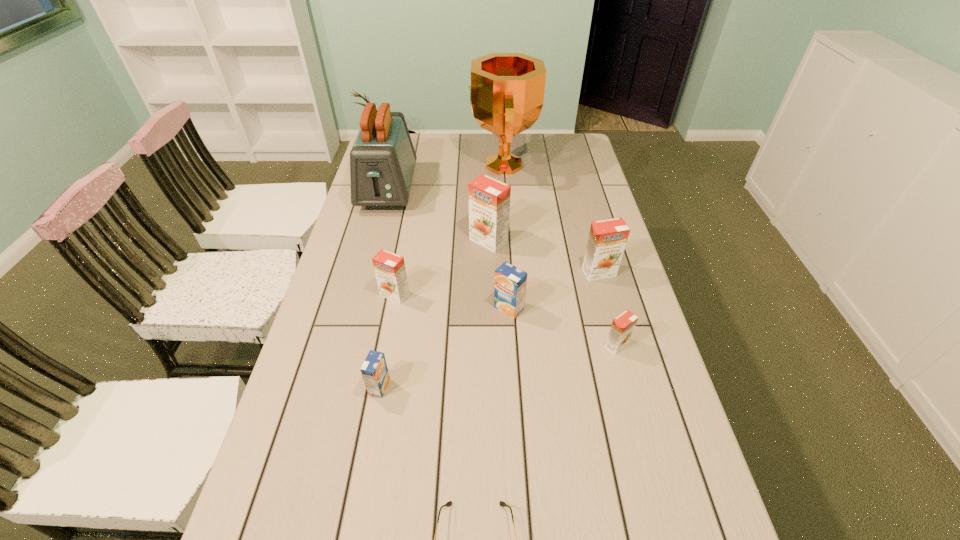
Locate an element on the screen. The height and width of the screenshot is (540, 960). the fifth closest orange juice relative to the second tallest object is located at coordinates (374, 370).

Select which orange orange juice is the second closest to the tallest orange juice. Please provide its 2D coordinates. Your answer should be formatted as a tuple, i.e. [(x, y)], where the tuple contains the x and y coordinates of a point satisfying the conditions above.

[(607, 239)]

Identify which orange orange juice is located as the second nearest to the black sunglasses. Please provide its 2D coordinates. Your answer should be formatted as a tuple, i.e. [(x, y)], where the tuple contains the x and y coordinates of a point satisfying the conditions above.

[(389, 268)]

The height and width of the screenshot is (540, 960). Find the location of `free space that satisfies the following two spatial constraints: 1. on the front-facing side of the seventh shortest object; 2. on the left side of the toaster`. free space that satisfies the following two spatial constraints: 1. on the front-facing side of the seventh shortest object; 2. on the left side of the toaster is located at coordinates (374, 241).

Find the location of a particular element. The width and height of the screenshot is (960, 540). free region that satisfies the following two spatial constraints: 1. on the front-facing side of the toaster; 2. on the left side of the right blue orange_juice is located at coordinates (357, 308).

Identify the location of vacant area that satisfies the following two spatial constraints: 1. on the front-facing side of the second tallest object; 2. on the right side of the right blue orange_juice. (357, 308).